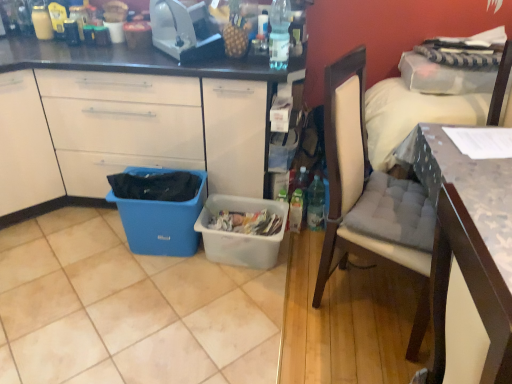
This screenshot has width=512, height=384. Identify the location of vacant space to the right of translucent plastic picnic basket at center. click(316, 266).